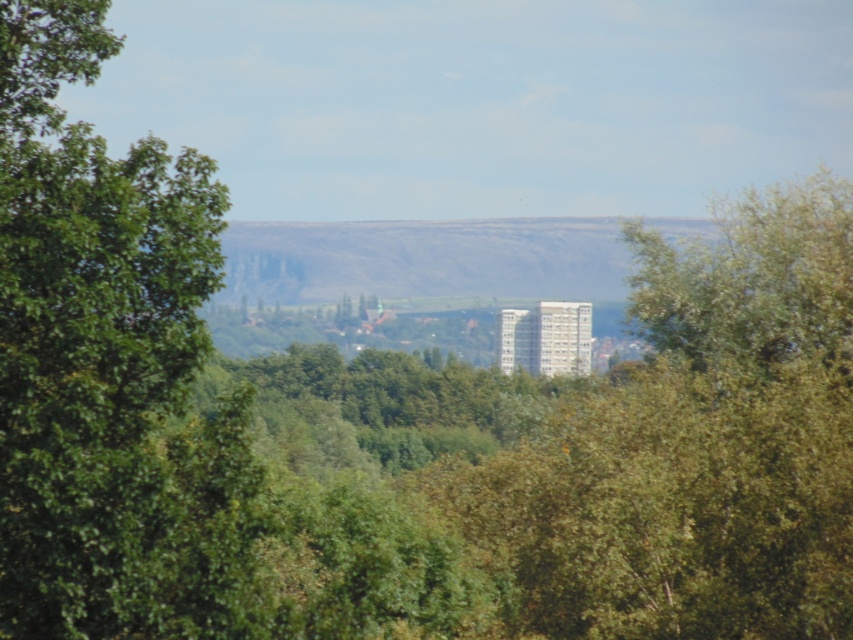
Question: Which point is farther to the camera?

Choices:
 (A) green leafy tree at left
 (B) rocky cliff at center

Answer: (B)

Question: Which point is closer to the camera taking this photo?

Choices:
 (A) (248, 604)
 (B) (601, 224)

Answer: (A)

Question: Is green leafy tree at left to the left of rocky cliff at center from the viewer's perspective?

Choices:
 (A) yes
 (B) no

Answer: (A)

Question: Is green leafy tree at left smaller than rocky cliff at center?

Choices:
 (A) yes
 (B) no

Answer: (A)

Question: Can you confirm if green leafy tree at left is positioned to the left of rocky cliff at center?

Choices:
 (A) no
 (B) yes

Answer: (B)